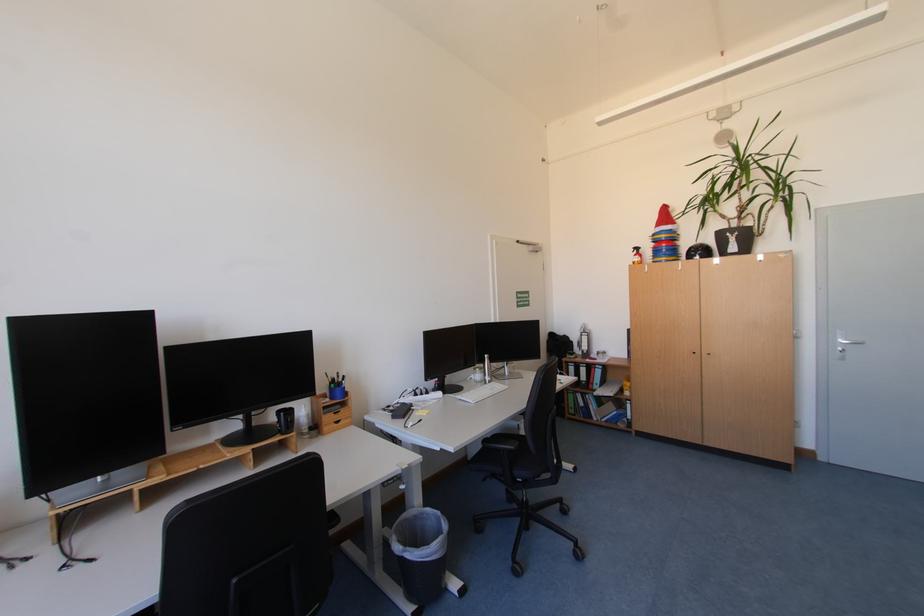
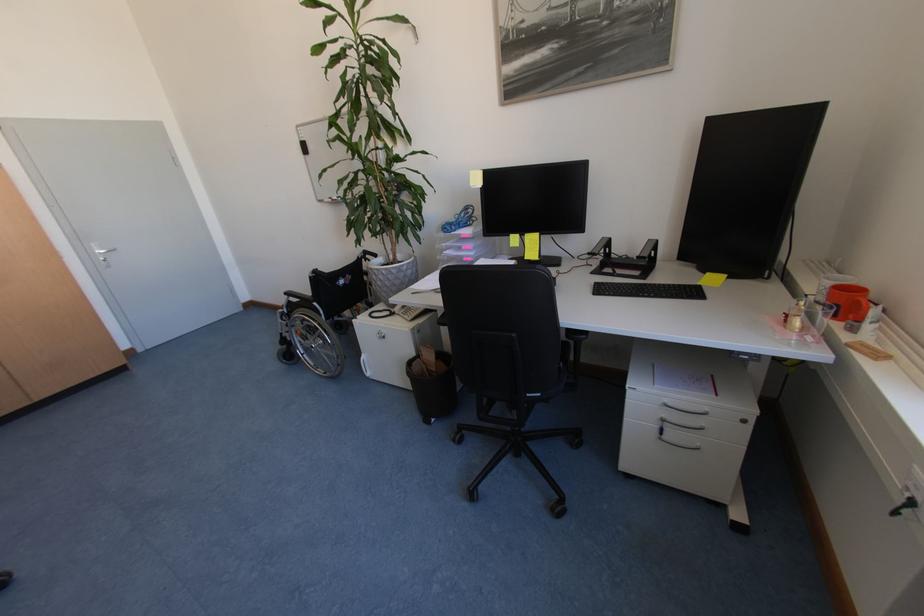
The point at (848,341) is marked in the first image. Where is the corresponding point in the second image?

(105, 253)